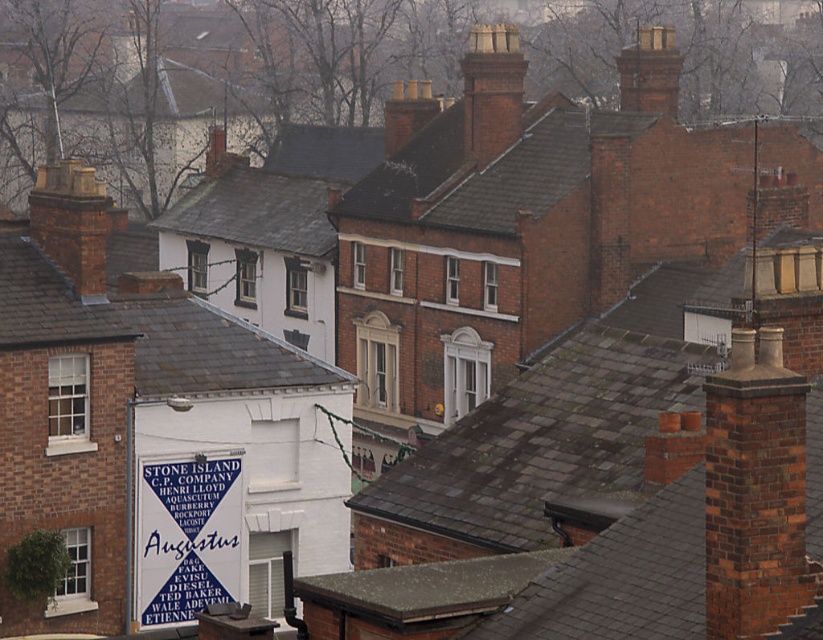
Question: Does blue paper sign at center appear under red brick chimney at upper right?

Choices:
 (A) no
 (B) yes

Answer: (B)

Question: Which point is closer to the camera?

Choices:
 (A) blue paper sign at center
 (B) red brick chimney at upper right

Answer: (A)

Question: Estimate the real-world distances between objects in this image. Which object is farther from the blue paper sign at center?

Choices:
 (A) red brick chimney at center
 (B) red brick chimney at upper right

Answer: (B)

Question: Does blue paper sign at center have a greater width compared to red brick chimney at upper right?

Choices:
 (A) no
 (B) yes

Answer: (A)

Question: Based on their relative distances, which object is farther from the red brick chimney at center?

Choices:
 (A) red brick chimney at upper right
 (B) blue paper sign at center

Answer: (B)

Question: Does red brick chimney at center have a larger size compared to red brick chimney at upper right?

Choices:
 (A) yes
 (B) no

Answer: (A)